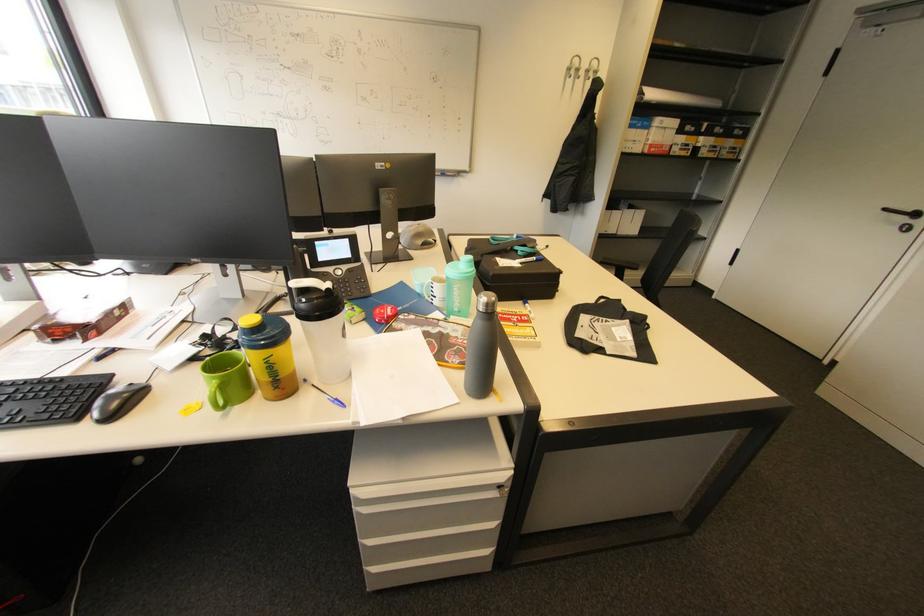
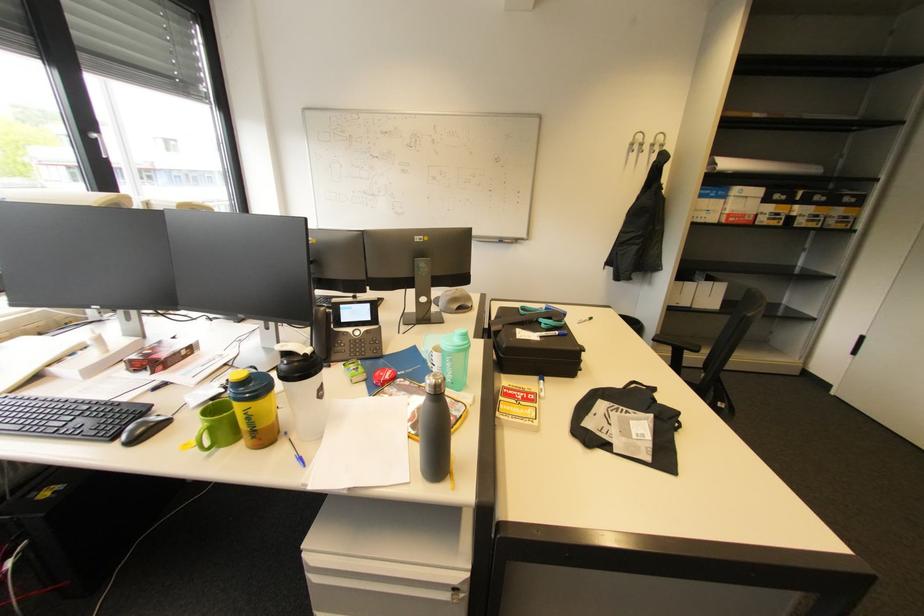
Question: What movement of the cameraman would produce the second image?

Choices:
 (A) Left
 (B) Right
 (C) Forward
 (D) Backward

Answer: (B)